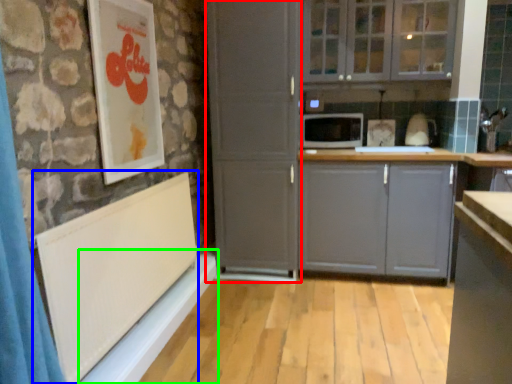
Question: Considering the real-world distances, which object is closest to screen door (highlighted by a red box)? bulletin board (highlighted by a blue box) or window sill (highlighted by a green box).

Choices:
 (A) bulletin board
 (B) window sill

Answer: (B)